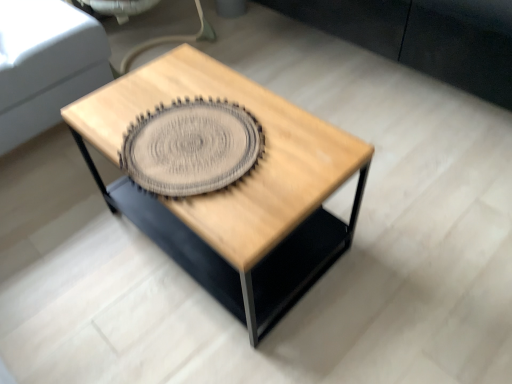
Find the location of a particular element. Image resolution: width=512 pixels, height=384 pixels. vacant space positioned to the left of natural wood coffee table at center is located at coordinates (76, 260).